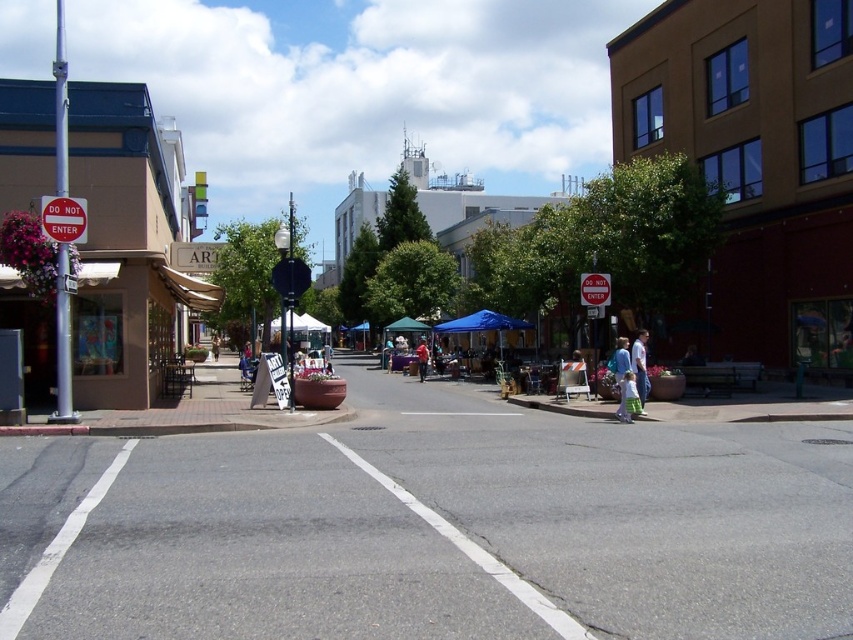
Looking at this image, you are a delivery drone operator. Your drone is currently hovering at the camera position. You need to land it on the smooth concrete sidewalk at center. Is the distance safe for landing?

The distance of smooth concrete sidewalk at center from camera is 18.14 meters, so the drone can safely land there as the distance is within operational limits.

You are a pedestrian standing at the edge of the street and see both the red plastic stop sign at center and the matte red shirt at center. Which object is higher up from the ground?

The red plastic stop sign at center is located above the matte red shirt at center, so it is higher up from the ground.